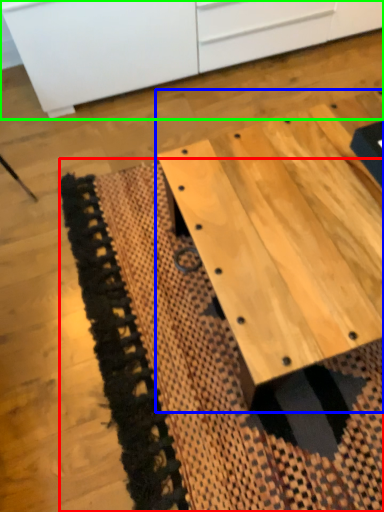
Question: Considering the real-world distances, which object is closest to mat (highlighted by a red box)? table (highlighted by a blue box) or cabinetry (highlighted by a green box).

Choices:
 (A) table
 (B) cabinetry

Answer: (A)